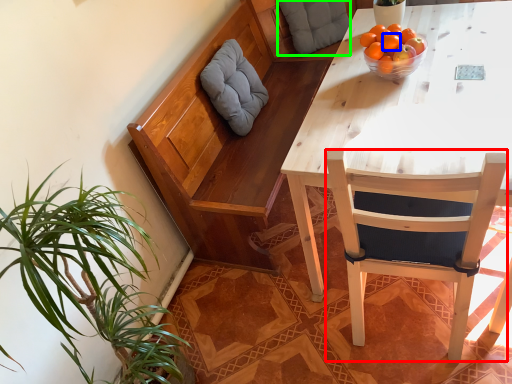
Question: Estimate the real-world distances between objects in this image. Which object is farther from chair (highlighted by a red box), tangerine (highlighted by a blue box) or pillow (highlighted by a green box)?

Choices:
 (A) tangerine
 (B) pillow

Answer: (B)